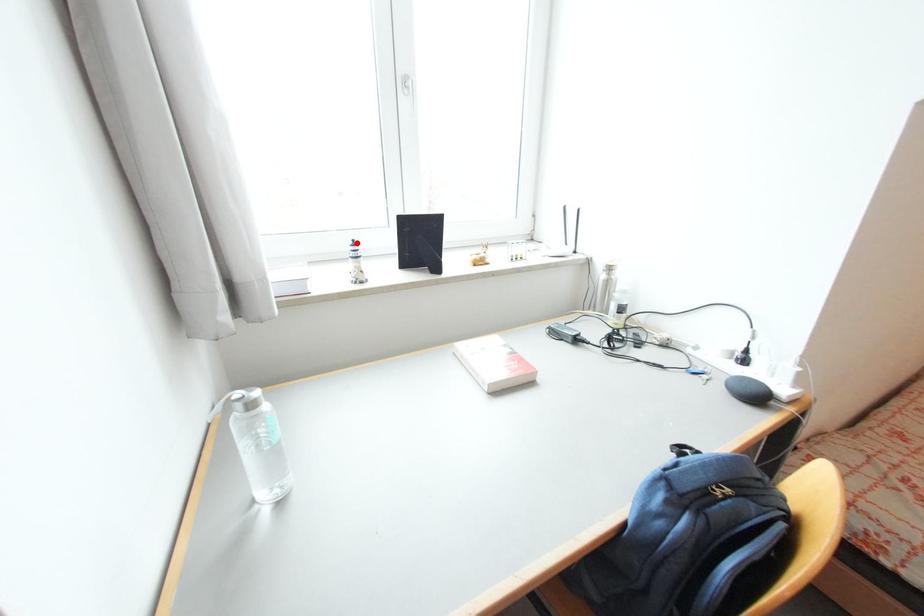
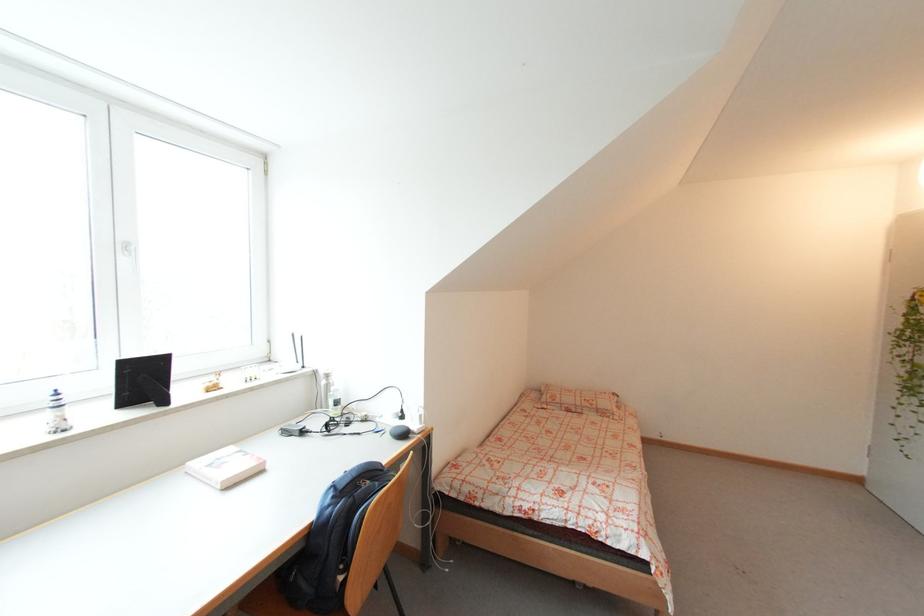
Find the pixel in the second image that matches the highlighted location in the first image.

(58, 392)